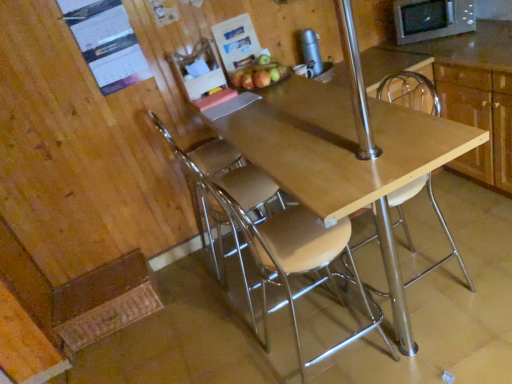
Identify the location of vacant space underneath wooden seat at center, which is the 2th chair from left to right (from a real-world perspective). (309, 358).